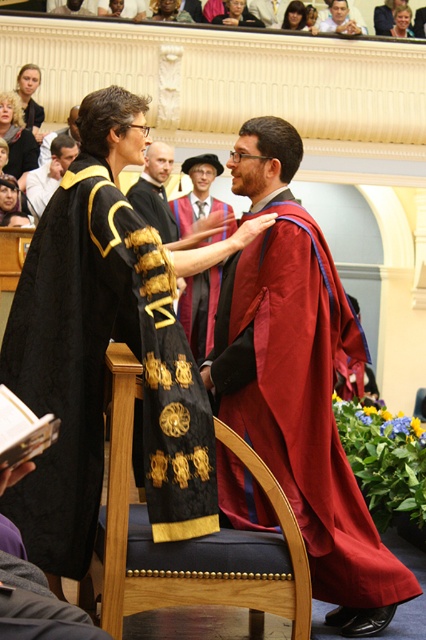
Question: Which object is closer to the camera taking this photo?

Choices:
 (A) matte black robe at center
 (B) velvet black gown at center
 (C) smooth brown hair at upper center
 (D) matte black robe at left

Answer: (B)

Question: Can you confirm if velvet black gown at center is positioned to the left of smooth black robe at center?

Choices:
 (A) no
 (B) yes

Answer: (A)

Question: Is matte black robe at center positioned at the back of smooth brown hair at upper center?

Choices:
 (A) no
 (B) yes

Answer: (A)

Question: Which of the following is the closest to the observer?

Choices:
 (A) velvet black gown at center
 (B) maroon velvet graduation gown at center
 (C) black wood chair at center

Answer: (C)

Question: Which point is farther to the camera?

Choices:
 (A) maroon velvet gown at center
 (B) smooth black robe at center

Answer: (B)

Question: Observing the image, what is the correct spatial positioning of velvet black gown at center in reference to maroon velvet graduation gown at center?

Choices:
 (A) right
 (B) left

Answer: (B)